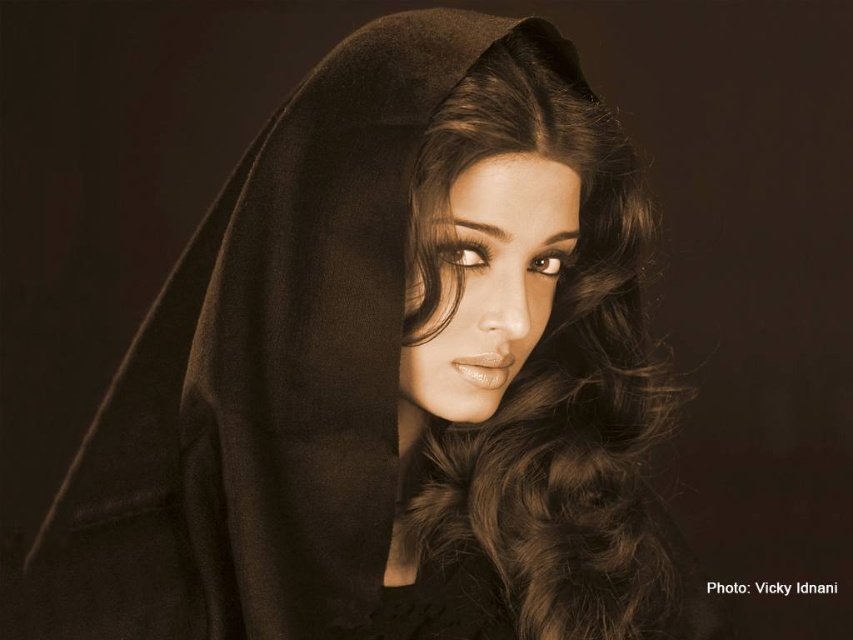
Who is higher up, brown silky hair at center or smooth skin face at center?

smooth skin face at center is above.

At what (x,y) coordinates should I click in order to perform the action: click on brown silky hair at center. Please return your answer as a coordinate pair (x, y). The width and height of the screenshot is (853, 640). Looking at the image, I should click on (532, 362).